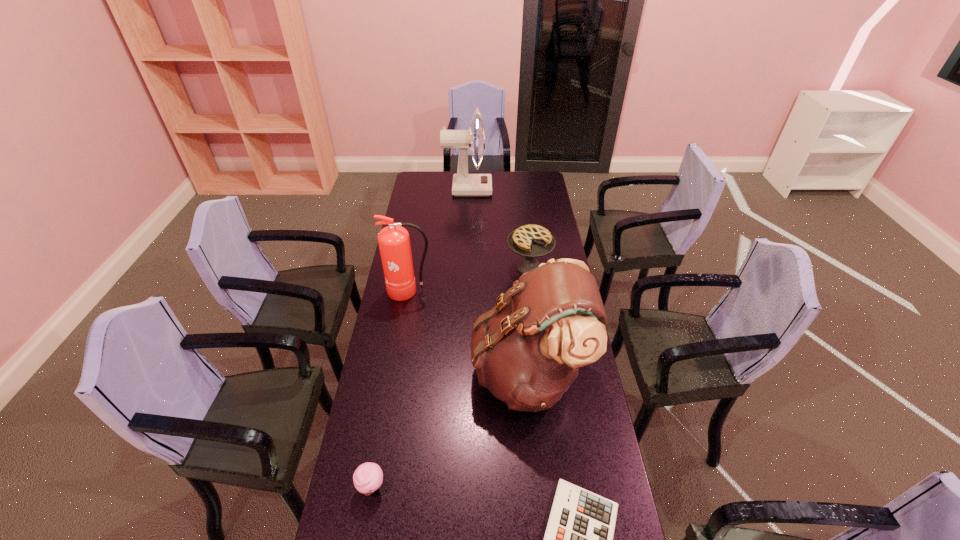
Where is `vacant point located between the fire extinguisher and the fourth tallest object`? This screenshot has height=540, width=960. vacant point located between the fire extinguisher and the fourth tallest object is located at coordinates (469, 279).

At what (x,y) coordinates should I click in order to perform the action: click on unoccupied area between the fan and the fourth shortest object. Please return your answer as a coordinate pair (x, y). The image size is (960, 540). Looking at the image, I should click on (439, 240).

Image resolution: width=960 pixels, height=540 pixels. What are the coordinates of `free space between the fire extinguisher and the pie` in the screenshot? It's located at (469, 279).

Find the location of a particular element. The width and height of the screenshot is (960, 540). free space between the fan and the fire extinguisher is located at coordinates (439, 240).

Locate an element on the screen. The image size is (960, 540). vacant space that is in between the satchel and the fan is located at coordinates (498, 281).

Identify the location of vacant point located between the fifth tallest object and the fire extinguisher. (391, 389).

I want to click on vacant area that lies between the third tallest object and the fan, so click(x=439, y=240).

Identify which object is the fourth nearest to the fourth shortest object. Please provide its 2D coordinates. Your answer should be formatted as a tuple, i.e. [(x, y)], where the tuple contains the x and y coordinates of a point satisfying the conditions above.

[(368, 477)]

The width and height of the screenshot is (960, 540). I want to click on object identified as the third closest to the second shortest object, so click(x=394, y=243).